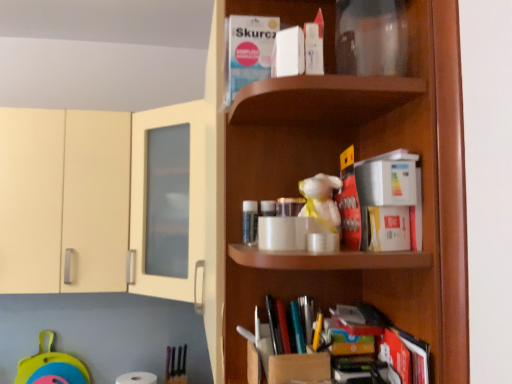
Question: From a real-world perspective, is white matte toilet paper at lower left above or below white matte book at upper center, which is the fourth book in right-to-left order?

Choices:
 (A) above
 (B) below

Answer: (B)

Question: Is white matte toilet paper at lower left wider or thinner than white matte book at upper center, acting as the second book starting from the left?

Choices:
 (A) wide
 (B) thin

Answer: (A)

Question: Which is farther from the hardcover book at lower right, which is the fifth book in top-to-bottom order?

Choices:
 (A) white matte book at upper center, which is the 4th book from bottom to top
 (B) white matte book at upper center, positioned as the fifth book in bottom-to-top order
 (C) red matte book at center, placed as the fourth book when sorted from left to right
 (D) multicolored plastic books at lower center, the third book when ordered from left to right
 (E) white matte toilet paper at lower left

Answer: (E)

Question: Estimate the real-world distances between objects in this image. Which object is closer to the cardboard box at lower center?

Choices:
 (A) multicolored plastic books at lower center, the third book when ordered from left to right
 (B) red matte book at center, acting as the 3th book starting from the top
 (C) hardcover book at lower right, which is the fifth book in top-to-bottom order
 (D) white matte book at upper center, arranged as the 5th book when viewed from the right
 (E) white matte book at upper center, which is the fourth book in right-to-left order

Answer: (A)